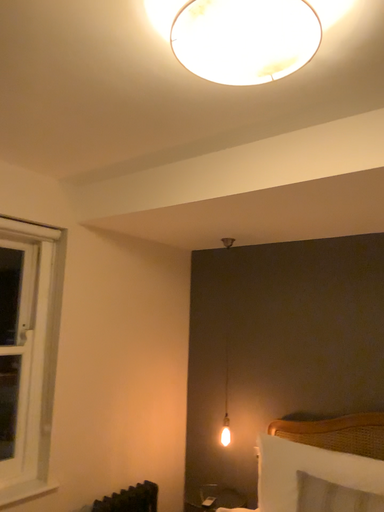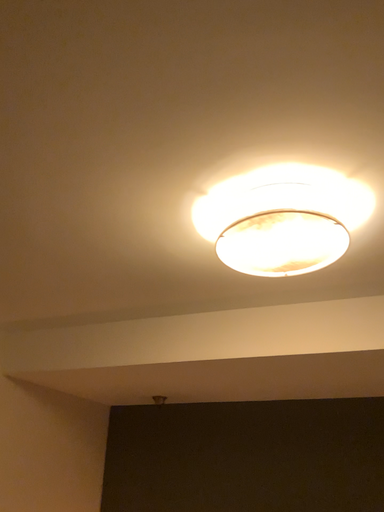
Question: How did the camera likely rotate when shooting the video?

Choices:
 (A) rotated right
 (B) rotated left

Answer: (A)